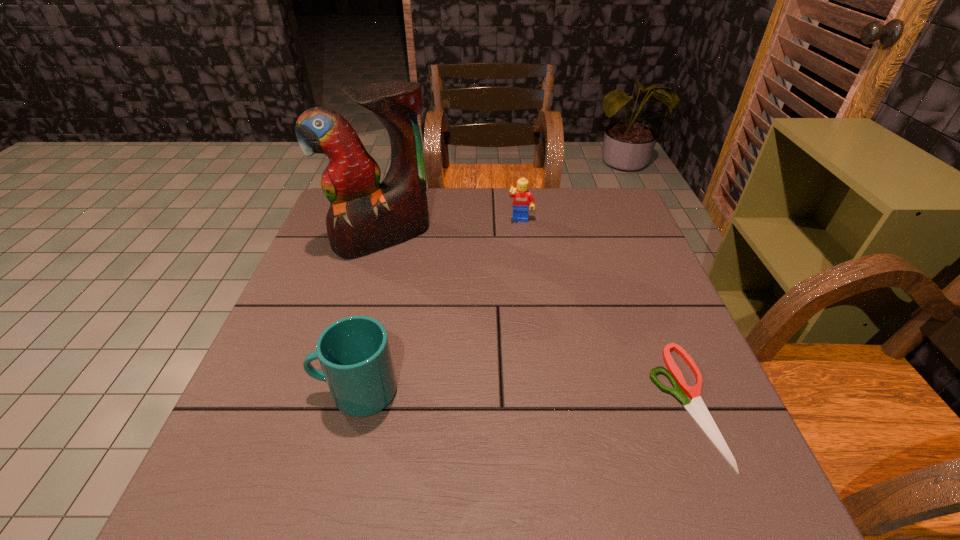
Identify the location of free space between the cup and the tallest object. (370, 314).

Find the location of a particular element. empty space between the Lego and the parrot is located at coordinates [x=452, y=229].

Find the location of a particular element. The image size is (960, 540). free spot between the parrot and the Lego is located at coordinates (452, 229).

At what (x,y) coordinates should I click in order to perform the action: click on vacant space that is in between the parrot and the cup. Please return your answer as a coordinate pair (x, y). This screenshot has height=540, width=960. Looking at the image, I should click on (370, 314).

Locate an element on the screen. The image size is (960, 540). vacant space in between the parrot and the cup is located at coordinates (370, 314).

This screenshot has height=540, width=960. In order to click on vacant area that lies between the scissors and the tallest object in this screenshot , I will do pos(534,320).

Where is `empty space between the Lego and the parrot`? The height and width of the screenshot is (540, 960). empty space between the Lego and the parrot is located at coordinates (452, 229).

Identify the location of vacant space that's between the second object from right to left and the cup. [439, 306].

Point out which object is positioned as the third nearest to the cup. Please provide its 2D coordinates. Your answer should be formatted as a tuple, i.e. [(x, y)], where the tuple contains the x and y coordinates of a point satisfying the conditions above.

[(523, 200)]

You are a GUI agent. You are given a task and a screenshot of the screen. Output one action in this format:
    pyautogui.click(x=<x>, y=<y>)
    Task: Click on the object that is the third closest to the parrot
    
    Given the screenshot: What is the action you would take?
    pyautogui.click(x=696, y=408)